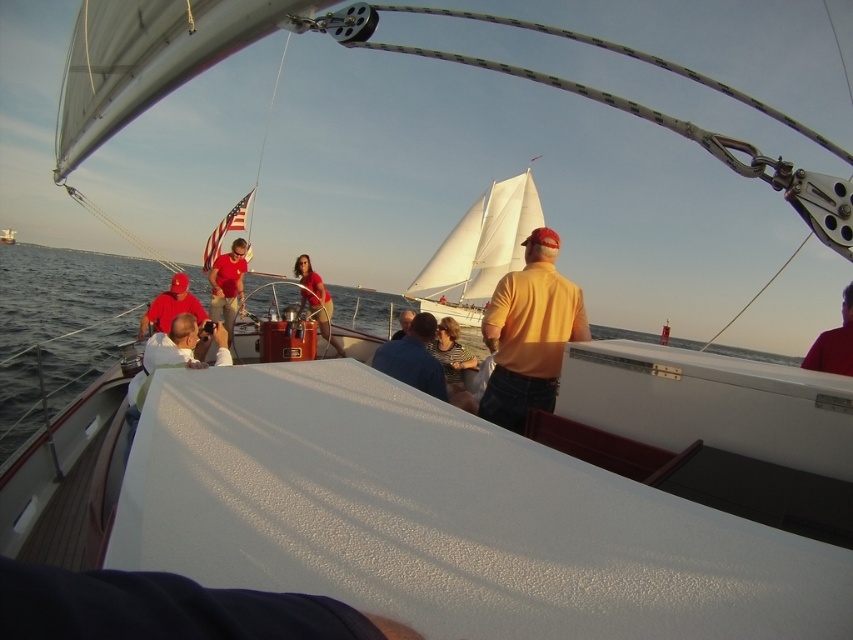
You are a photographer on the deck of the sailboat and want to capture both the orange matte shirt at center and the matte yellow shirt at center in a single shot. Which shirt should you focus on first to ensure both are in frame?

The orange matte shirt at center is larger in size than the matte yellow shirt at center, so focusing on the orange matte shirt at center first will ensure both are in frame as it occupies more space in the image.

Consider the image. You are a photographer positioned at the camera location. You want to capture a closeup shot of the matte red cap at center. Given that your camera has a minimum focusing distance of 2 meters, will you be able to achieve a clear closeup without moving closer?

The distance between the matte red cap at center and the camera is 4.87 meters, which is greater than the minimum focusing distance of 2 meters. Therefore, you can achieve a clear closeup without moving closer.